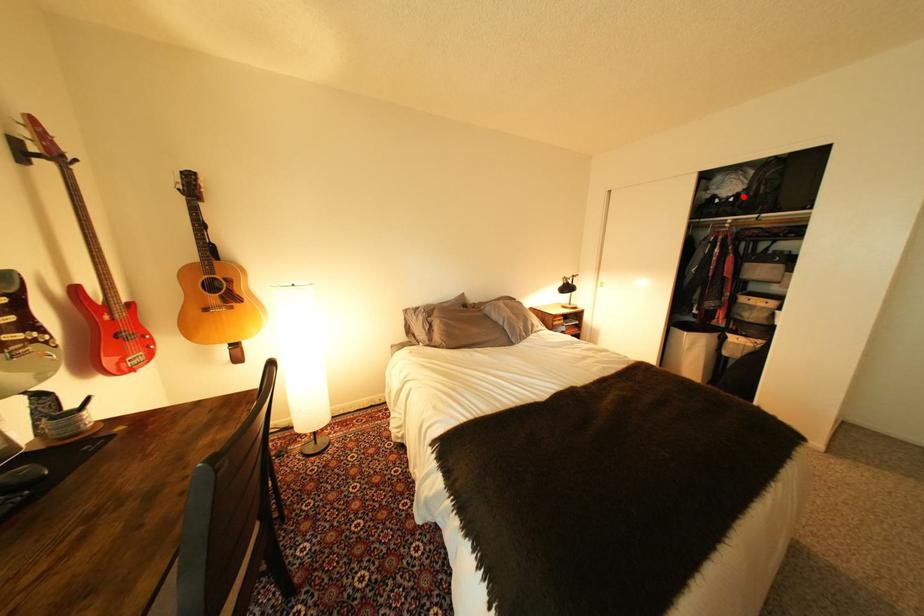
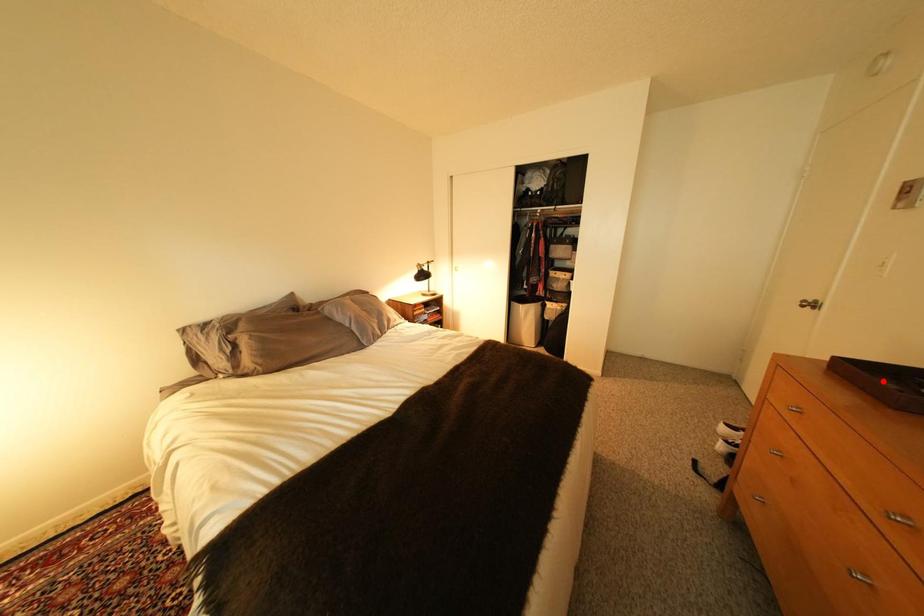
I am providing you with two images of the same scene from different viewpoints. A red point is marked on the first image and another point is marked on the second image. Does the point marked in image1 correspond to the same location as the one in image2?

No